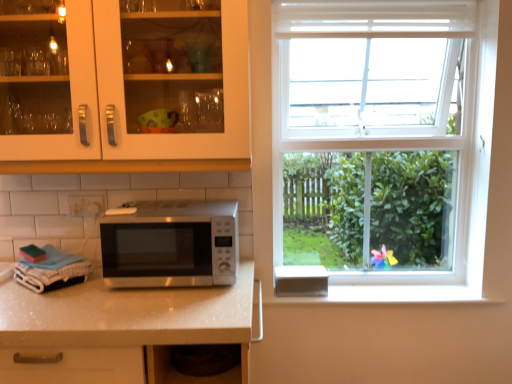
Question: Is matte white cabinet at upper left further to camera compared to satin silver microwave at center?

Choices:
 (A) yes
 (B) no

Answer: (B)

Question: Is matte white cabinet at upper left completely or partially outside of satin silver microwave at center?

Choices:
 (A) yes
 (B) no

Answer: (A)

Question: From the image's perspective, is matte white cabinet at upper left on top of satin silver microwave at center?

Choices:
 (A) yes
 (B) no

Answer: (A)

Question: From the image's perspective, does matte white cabinet at upper left appear lower than satin silver microwave at center?

Choices:
 (A) yes
 (B) no

Answer: (B)

Question: Is the position of matte white cabinet at upper left less distant than that of satin silver microwave at center?

Choices:
 (A) no
 (B) yes

Answer: (B)

Question: Is matte white cabinet at upper left facing away from satin silver microwave at center?

Choices:
 (A) no
 (B) yes

Answer: (A)

Question: Is matte white cabinet at upper left inside satin silver microwave at center?

Choices:
 (A) no
 (B) yes

Answer: (A)

Question: Is there a large distance between satin silver microwave at center and matte white cabinet at upper left?

Choices:
 (A) yes
 (B) no

Answer: (B)

Question: From a real-world perspective, is satin silver microwave at center over matte white cabinet at upper left?

Choices:
 (A) no
 (B) yes

Answer: (A)

Question: Considering the relative sizes of satin silver microwave at center and matte white cabinet at upper left in the image provided, is satin silver microwave at center bigger than matte white cabinet at upper left?

Choices:
 (A) no
 (B) yes

Answer: (A)

Question: From a real-world perspective, is satin silver microwave at center located beneath matte white cabinet at upper left?

Choices:
 (A) no
 (B) yes

Answer: (B)

Question: Is satin silver microwave at center located outside matte white cabinet at upper left?

Choices:
 (A) no
 (B) yes

Answer: (B)

Question: Considering their positions, is matte white cabinet at upper left located in front of or behind satin silver microwave at center?

Choices:
 (A) behind
 (B) front

Answer: (B)